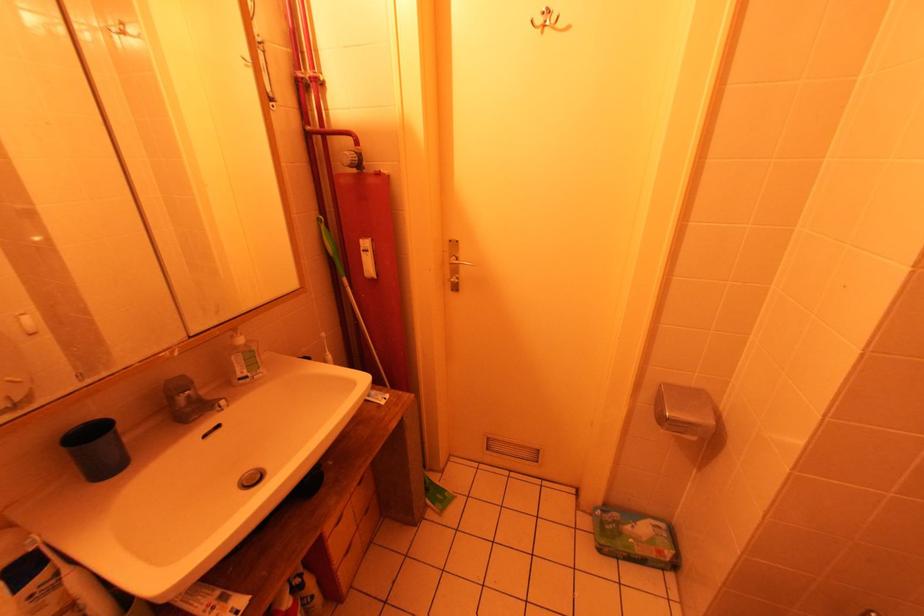
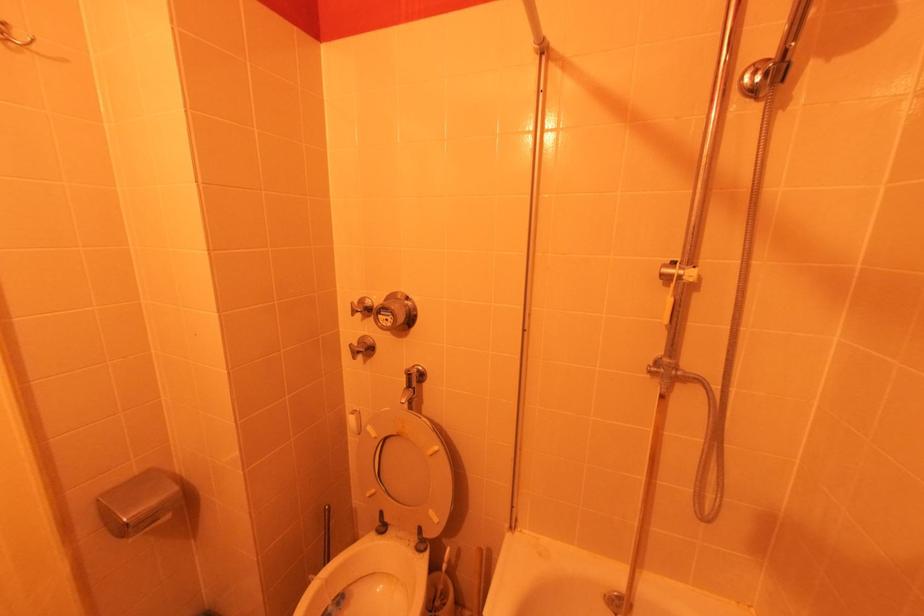
Question: The images are taken continuously from a first-person perspective. In which direction is your viewpoint rotating?

Choices:
 (A) Left
 (B) Right
 (C) Up
 (D) Down

Answer: (B)